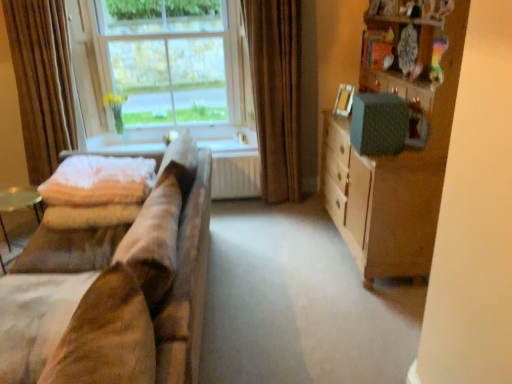
Question: Which is correct: clear glass window at upper left is inside white fabric at lower left, or outside of it?

Choices:
 (A) inside
 (B) outside

Answer: (B)

Question: In the image, is clear glass window at upper left positioned in front of or behind white fabric at lower left?

Choices:
 (A) front
 (B) behind

Answer: (A)

Question: Estimate the real-world distances between objects in this image. Which object is closer to the soft pink quilt at left?

Choices:
 (A) beige fabric curtain at left, acting as the first curtain starting from the left
 (B) white fabric at lower left
 (C) clear glass window at upper left
 (D) suede-like beige couch at left
 (E) wooden cabinet at right

Answer: (B)

Question: Which of these objects is positioned closest to the soft pink quilt at left?

Choices:
 (A) white fabric at lower left
 (B) wooden cabinet at right
 (C) beige fabric curtain at left, the second curtain when ordered from right to left
 (D) clear glass window at upper left
 (E) suede-like beige couch at left

Answer: (A)